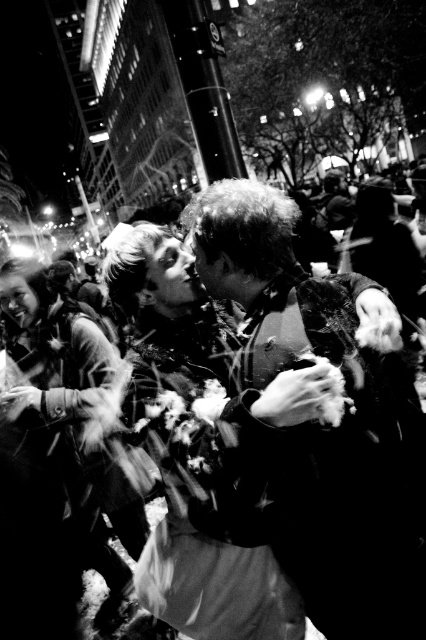
Question: Does fur-lined coat at left appear over white fluffy flower at center?

Choices:
 (A) yes
 (B) no

Answer: (B)

Question: Which object is the closest to the matte fabric dress at center?

Choices:
 (A) shiny black jacket at center
 (B) white fluffy flower at center

Answer: (A)

Question: Which point is closer to the camera?

Choices:
 (A) fur-lined coat at left
 (B) matte fabric dress at center
 (C) shiny black jacket at center
 (D) white fluffy flower at center

Answer: (B)

Question: Is shiny black jacket at center to the right of fluffy white flower at center from the viewer's perspective?

Choices:
 (A) yes
 (B) no

Answer: (B)

Question: Which object is the closest to the shiny black jacket at center?

Choices:
 (A) fluffy white flower at center
 (B) matte fabric dress at center
 (C) white fluffy flower at center
 (D) fur-lined coat at left

Answer: (A)

Question: Can you confirm if matte fabric dress at center is wider than white fluffy flower at center?

Choices:
 (A) no
 (B) yes

Answer: (B)